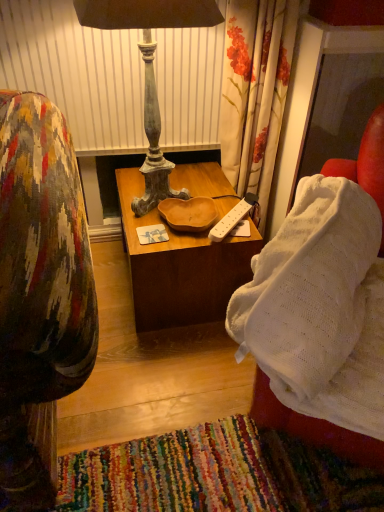
Question: Is white knitted blanket at right touching white plastic power strip at center?

Choices:
 (A) yes
 (B) no

Answer: (B)

Question: Considering the relative sizes of white knitted blanket at right and white plastic power strip at center in the image provided, is white knitted blanket at right taller than white plastic power strip at center?

Choices:
 (A) no
 (B) yes

Answer: (B)

Question: From the image's perspective, does white knitted blanket at right appear higher than white plastic power strip at center?

Choices:
 (A) no
 (B) yes

Answer: (A)

Question: Is white knitted blanket at right not inside white plastic power strip at center?

Choices:
 (A) no
 (B) yes

Answer: (B)

Question: From the image's perspective, is white knitted blanket at right under white plastic power strip at center?

Choices:
 (A) no
 (B) yes

Answer: (B)

Question: Considering the relative sizes of white knitted blanket at right and white plastic power strip at center in the image provided, is white knitted blanket at right shorter than white plastic power strip at center?

Choices:
 (A) no
 (B) yes

Answer: (A)

Question: Considering the relative positions of distressed wood lamp at center and wooden table at center in the image provided, is distressed wood lamp at center in front of wooden table at center?

Choices:
 (A) no
 (B) yes

Answer: (B)

Question: Can you confirm if distressed wood lamp at center is wider than wooden table at center?

Choices:
 (A) no
 (B) yes

Answer: (A)

Question: Does distressed wood lamp at center appear on the left side of wooden table at center?

Choices:
 (A) yes
 (B) no

Answer: (A)

Question: Is distressed wood lamp at center at the right side of wooden table at center?

Choices:
 (A) yes
 (B) no

Answer: (B)

Question: Is distressed wood lamp at center shorter than wooden table at center?

Choices:
 (A) yes
 (B) no

Answer: (B)

Question: Can you confirm if distressed wood lamp at center is thinner than wooden table at center?

Choices:
 (A) no
 (B) yes

Answer: (B)

Question: Considering the relative sizes of distressed wood lamp at center and white knitted blanket at right in the image provided, is distressed wood lamp at center shorter than white knitted blanket at right?

Choices:
 (A) no
 (B) yes

Answer: (A)